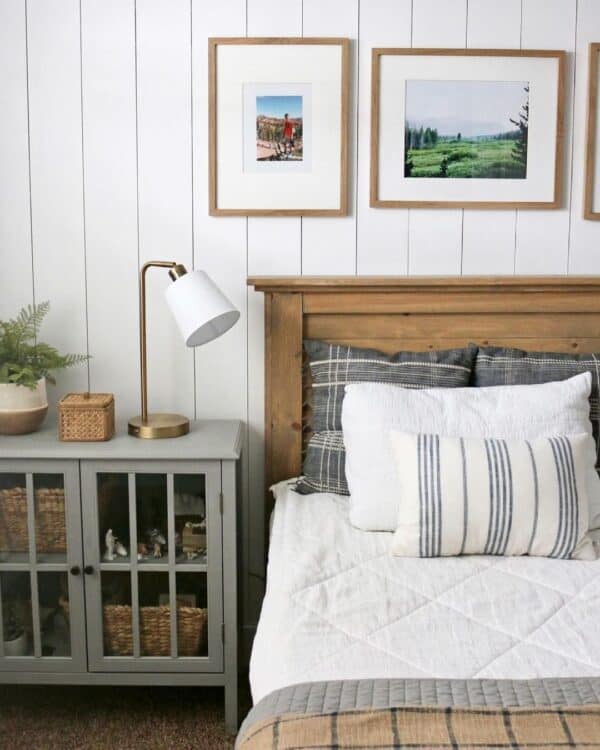
The width and height of the screenshot is (600, 750). In order to click on carpet in this screenshot , I will do `click(163, 720)`.